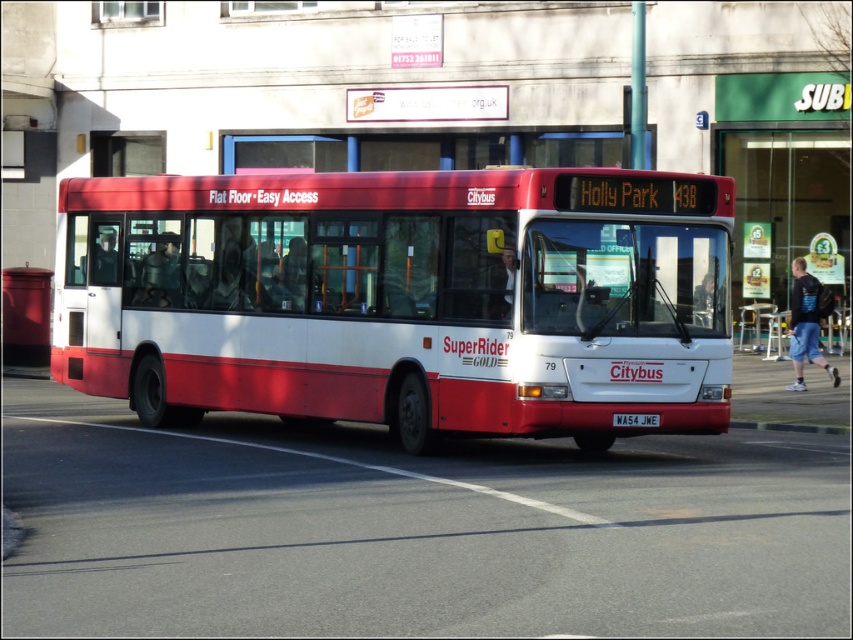
You are a delivery person who needs to park your 2.5 meter tall delivery van behind the matte red bus at center. The green glass door at upper center is part of a building behind the bus. Will the van fit vertically between the bus and the door without hitting the door?

The matte red bus at center is shorter than the green glass door at upper center. Since the van is 2.5 meters tall, it can fit vertically between the bus and the door as long as the available space between them is more than 2.5 meters. However, the exact height clearance isn

You are standing at the intersection and see the matte red bus at center. If you want to cross the street to reach the bus, which direction should you walk to be closest to it?

The matte red bus at center is located at point (403, 300), so you should walk towards the center of the street to be closest to it.